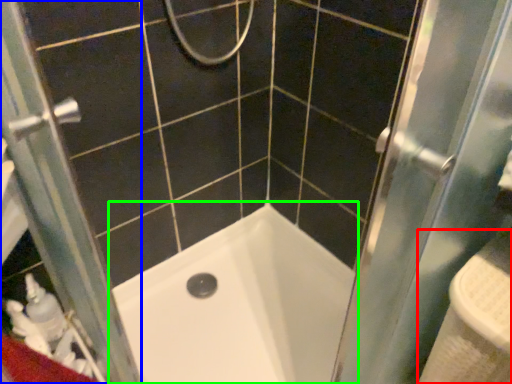
Question: Based on their relative distances, which object is farther from sink (highlighted by a red box)? Choose from screen door (highlighted by a blue box) and bathtub (highlighted by a green box).

Choices:
 (A) screen door
 (B) bathtub

Answer: (A)